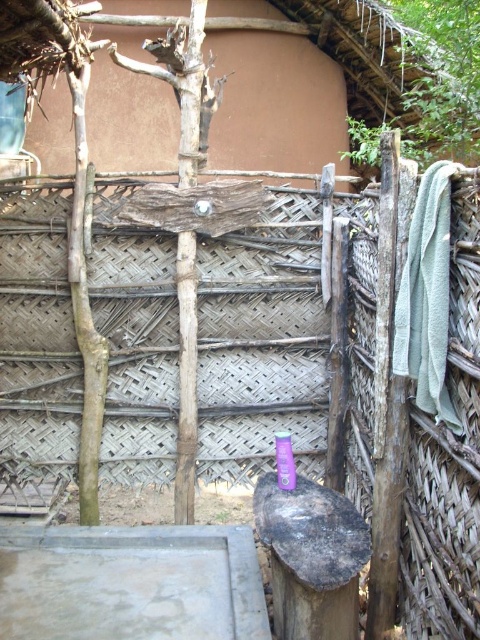
Question: Which point is closer to the camera?

Choices:
 (A) (428, 358)
 (B) (280, 440)

Answer: (A)

Question: Which object appears farthest from the camera in this image?

Choices:
 (A) purple plastic bottle at center
 (B) green terry towel at right

Answer: (A)

Question: Does green terry towel at right appear under purple plastic bottle at center?

Choices:
 (A) yes
 (B) no

Answer: (B)

Question: Is green terry towel at right thinner than purple plastic bottle at center?

Choices:
 (A) no
 (B) yes

Answer: (A)

Question: Observing the image, what is the correct spatial positioning of green terry towel at right in reference to purple plastic bottle at center?

Choices:
 (A) below
 (B) above

Answer: (B)